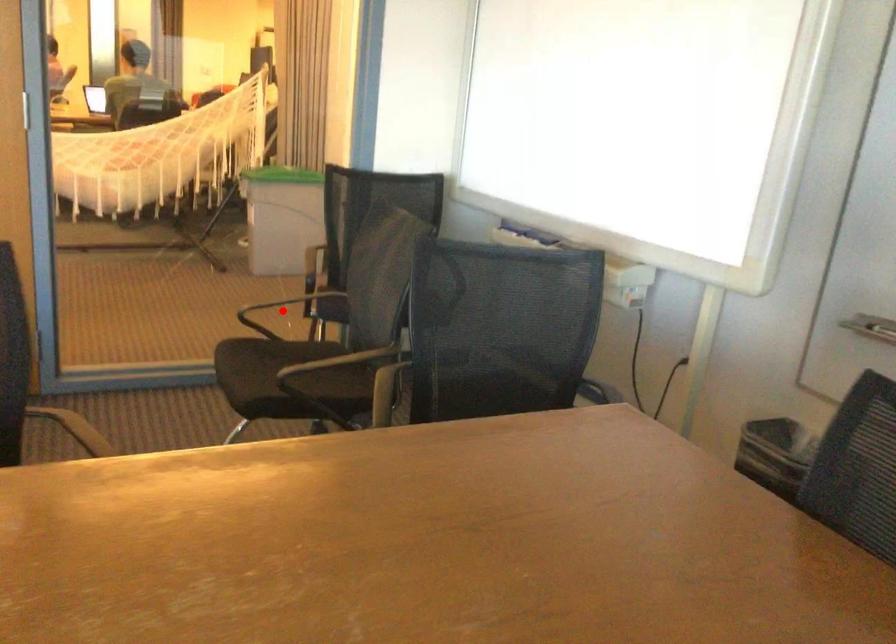
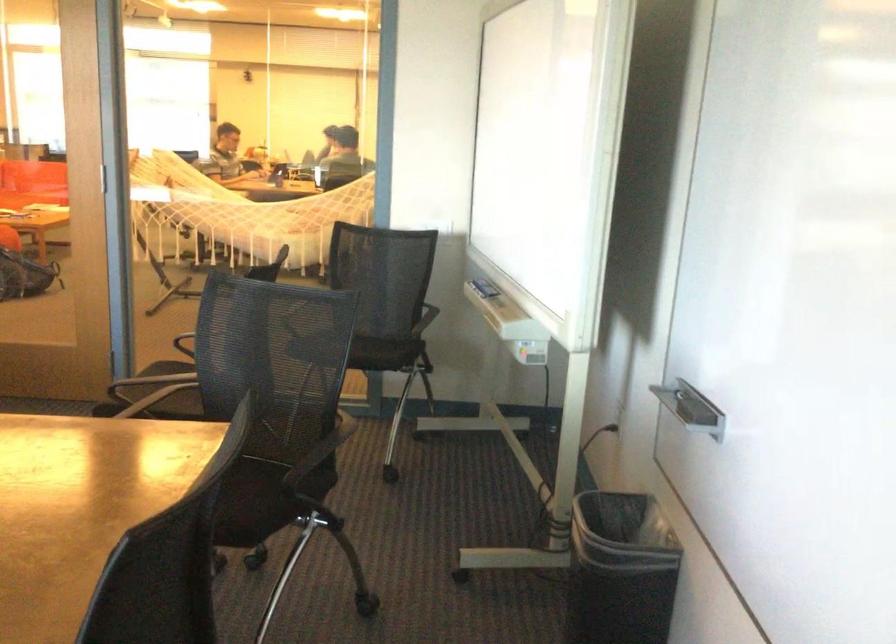
Question: I am providing you with two images of the same scene from different viewpoints. A red point is marked on the first image. Is the red point's position out of view in image 2?

Choices:
 (A) Yes
 (B) No

Answer: (A)